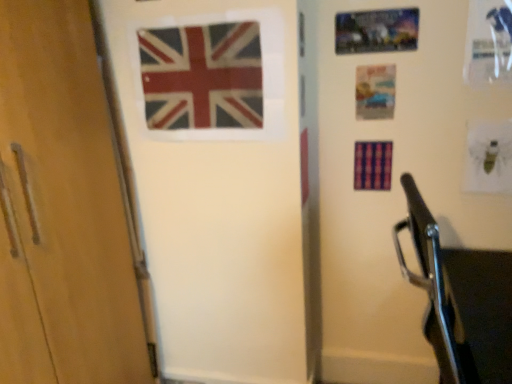
Question: Does matte paper postcard at upper right, acting as the 2th postcard starting from the top, touch metallic silver postcard at upper right, the second postcard from the bottom?

Choices:
 (A) yes
 (B) no

Answer: (B)

Question: Is matte paper postcard at upper right, acting as the 2th postcard starting from the top, closer to the viewer compared to metallic silver postcard at upper right, the second postcard from the bottom?

Choices:
 (A) yes
 (B) no

Answer: (B)

Question: Is matte paper postcard at upper right, acting as the 2th postcard starting from the top, to the left of metallic silver postcard at upper right, arranged as the 1th postcard when viewed from the top, from the viewer's perspective?

Choices:
 (A) yes
 (B) no

Answer: (B)

Question: Does matte paper postcard at upper right, which is the 1th postcard from bottom to top, have a greater height compared to metallic silver postcard at upper right, arranged as the 1th postcard when viewed from the top?

Choices:
 (A) yes
 (B) no

Answer: (A)

Question: From the image's perspective, is matte fabric flag at upper center, the first flag from the left, located above or below metallic silver postcard at upper right, arranged as the 1th postcard when viewed from the top?

Choices:
 (A) above
 (B) below

Answer: (B)

Question: Considering the positions of matte fabric flag at upper center, the first flag from the left, and metallic silver postcard at upper right, the second postcard from the bottom, in the image, is matte fabric flag at upper center, the first flag from the left, wider or thinner than metallic silver postcard at upper right, the second postcard from the bottom,?

Choices:
 (A) thin
 (B) wide

Answer: (B)

Question: Does point (215, 91) appear closer or farther from the camera than point (396, 31)?

Choices:
 (A) farther
 (B) closer

Answer: (B)

Question: Choose the correct answer: Is matte fabric flag at upper center, the first flag from the left, inside metallic silver postcard at upper right, the second postcard from the bottom, or outside it?

Choices:
 (A) inside
 (B) outside

Answer: (B)

Question: Considering the positions of matte plastic flag at center, the 2th flag in the right-to-left sequence, and plaid fabric flag at center, which is the first flag in right-to-left order, in the image, is matte plastic flag at center, the 2th flag in the right-to-left sequence, taller or shorter than plaid fabric flag at center, which is the first flag in right-to-left order,?

Choices:
 (A) short
 (B) tall

Answer: (B)

Question: From a real-world perspective, relative to plaid fabric flag at center, which is the first flag in right-to-left order, is matte plastic flag at center, the 2th flag in the right-to-left sequence, vertically above or below?

Choices:
 (A) below
 (B) above

Answer: (B)

Question: Is matte plastic flag at center, the 2th flag in the right-to-left sequence, to the left or to the right of plaid fabric flag at center, which is the first flag in right-to-left order, in the image?

Choices:
 (A) left
 (B) right

Answer: (A)

Question: In terms of width, does matte plastic flag at center, the 2th flag in the right-to-left sequence, look wider or thinner when compared to plaid fabric flag at center, which is the first flag in right-to-left order?

Choices:
 (A) thin
 (B) wide

Answer: (A)

Question: From the image's perspective, is matte paper postcard at upper right, which is the 1th postcard from bottom to top, above or below metallic silver postcard at upper right, arranged as the 1th postcard when viewed from the top?

Choices:
 (A) above
 (B) below

Answer: (B)

Question: Visually, is matte paper postcard at upper right, acting as the 2th postcard starting from the top, positioned to the left or to the right of metallic silver postcard at upper right, arranged as the 1th postcard when viewed from the top?

Choices:
 (A) left
 (B) right

Answer: (B)